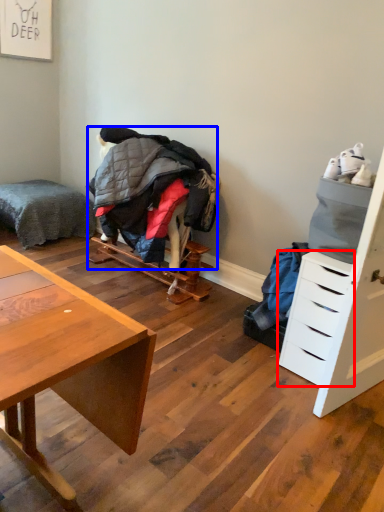
Question: Which point is closer to the camera, drawer (highlighted by a red box) or clothing (highlighted by a blue box)?

Choices:
 (A) drawer
 (B) clothing

Answer: (A)